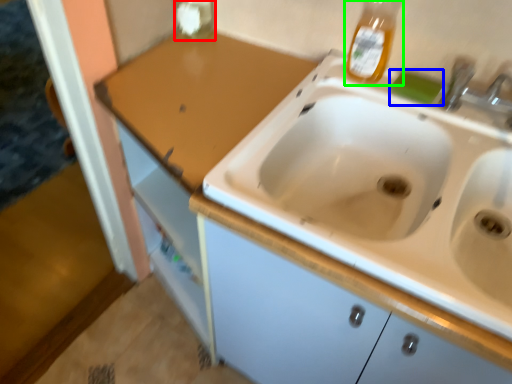
Question: Based on their relative distances, which object is farther from bottle (highlighted by a red box)? Choose from soap (highlighted by a blue box) and bottle (highlighted by a green box).

Choices:
 (A) soap
 (B) bottle

Answer: (A)